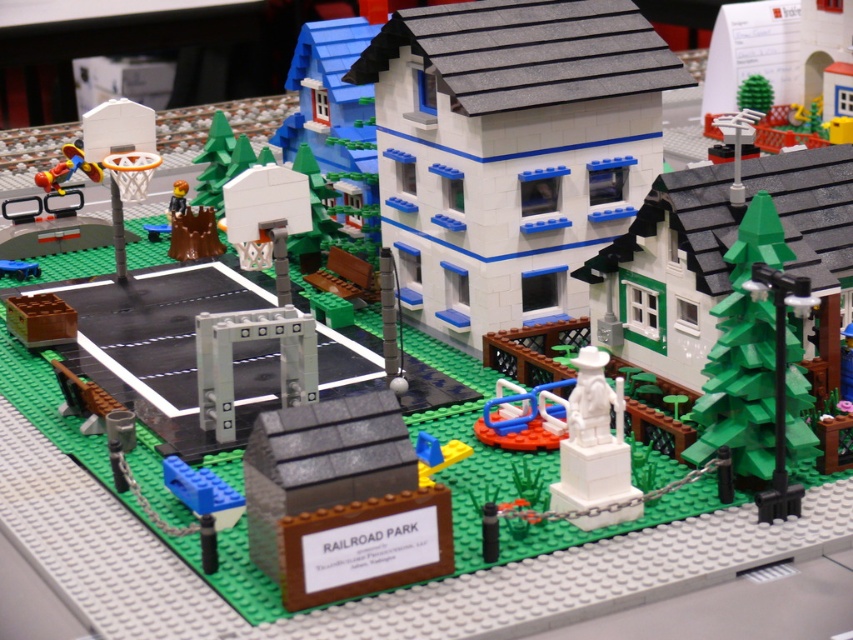
Which of these two, green matte tree at center-right or blue plastic toy at lower left, stands shorter?

blue plastic toy at lower left is shorter.

Can you confirm if green matte tree at center-right is wider than blue plastic toy at lower left?

Indeed, green matte tree at center-right has a greater width compared to blue plastic toy at lower left.

Where is `green matte tree at center-right`? Image resolution: width=853 pixels, height=640 pixels. green matte tree at center-right is located at coordinates (743, 353).

Between point (434, 125) and point (67, 176), which one is positioned in front?

Point (434, 125)

Who is more distant from viewer, (474, 145) or (50, 172)?

The point (50, 172) is more distant.

Locate an element on the screen. This screenshot has height=640, width=853. white matte building at center is located at coordinates (511, 150).

Who is positioned more to the left, white matte building at center or green matte tree at center-right?

From the viewer's perspective, white matte building at center appears more on the left side.

Between white matte building at center and green matte tree at center-right, which one is positioned lower?

Positioned lower is green matte tree at center-right.

What do you see at coordinates (511, 150) in the screenshot?
I see `white matte building at center` at bounding box center [511, 150].

Locate an element on the screen. white matte building at center is located at coordinates (511, 150).